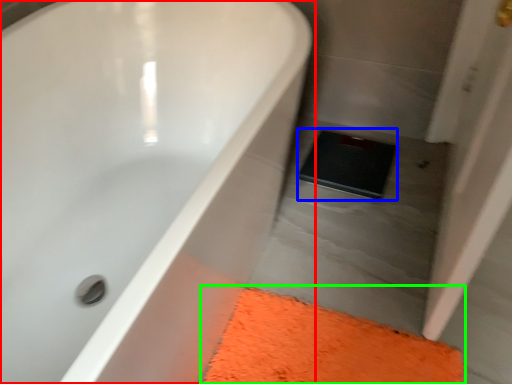
Question: Which object is positioned farthest from bathtub (highlighted by a red box)? Select from pad (highlighted by a blue box) and bath mat (highlighted by a green box).

Choices:
 (A) pad
 (B) bath mat

Answer: (A)